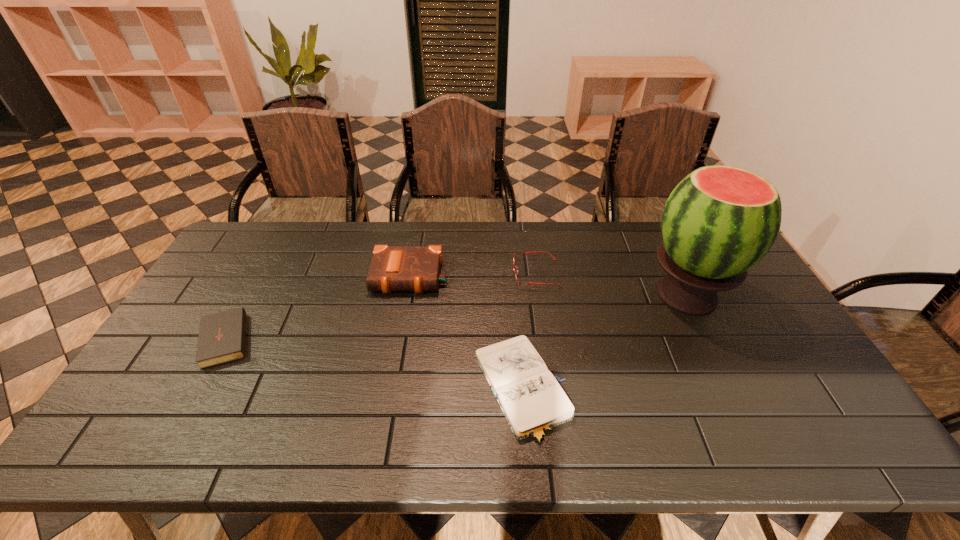
Identify the location of free space located 0.100m on the lenses of the spectacles. Image resolution: width=960 pixels, height=540 pixels. (482, 273).

Where is `vacant space situated on the lenses of the spectacles`? This screenshot has width=960, height=540. vacant space situated on the lenses of the spectacles is located at coordinates (420, 273).

Identify the location of blank area located on the lenses of the spectacles. (445, 273).

Identify the location of free spot located 0.070m on the left of the left Bible. The image size is (960, 540). (174, 336).

This screenshot has height=540, width=960. Identify the location of free space located on the back of the notebook. (514, 287).

This screenshot has height=540, width=960. Find the location of `Bible present at the far edge`. Bible present at the far edge is located at coordinates (393, 268).

Identify the location of spectacles at the far edge. The height and width of the screenshot is (540, 960). (521, 253).

Where is `object that is positioned at the near edge`? The width and height of the screenshot is (960, 540). object that is positioned at the near edge is located at coordinates point(533,402).

Where is `object that is at the left edge`? This screenshot has height=540, width=960. object that is at the left edge is located at coordinates (222, 336).

This screenshot has height=540, width=960. Identify the location of object that is at the right edge. (719, 221).